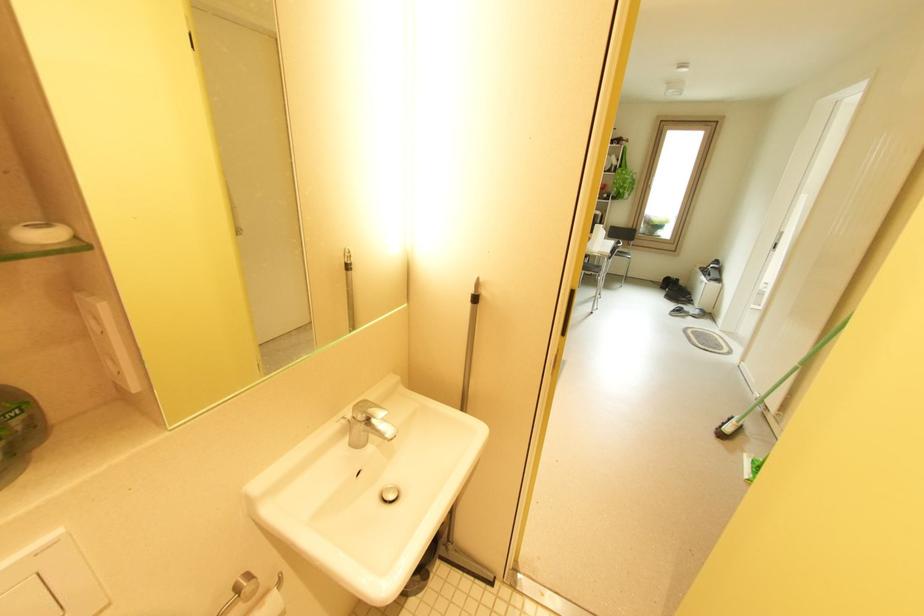
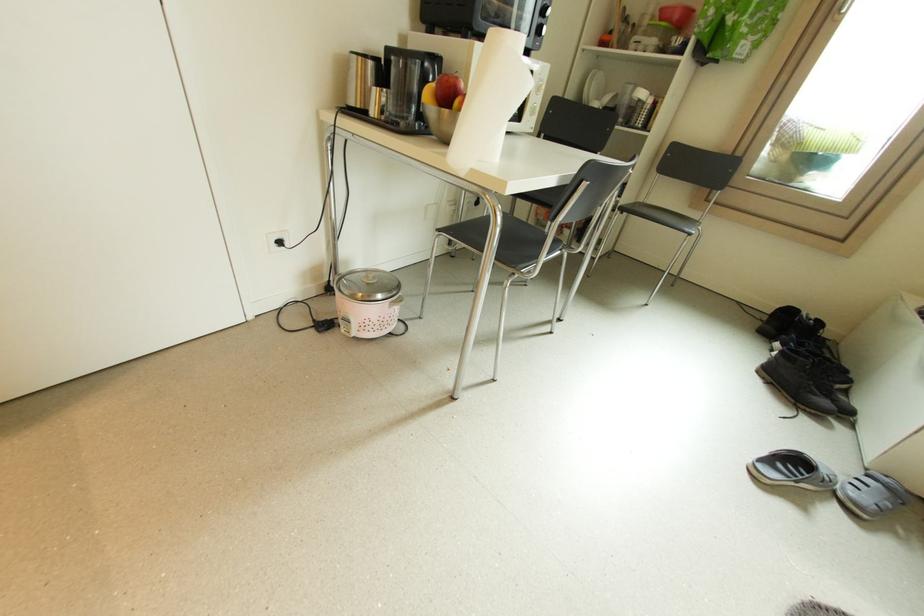
In the second image, find the point that corresponds to (x=699, y=314) in the first image.

(858, 495)